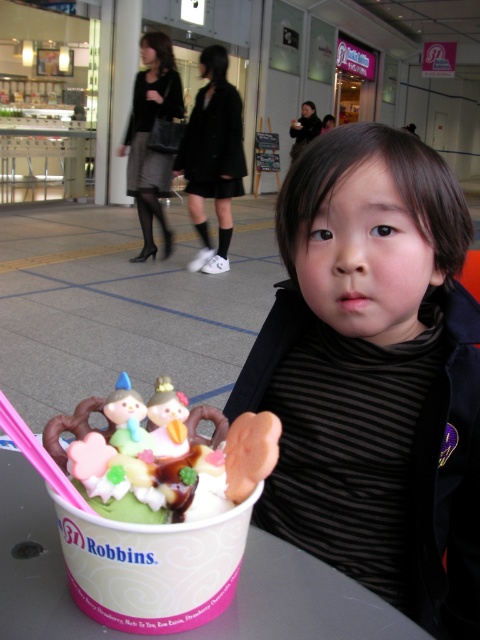
Question: Estimate the real-world distances between objects in this image. Which object is closer to the black fabric skirt at center?

Choices:
 (A) black striped shirt at center
 (B) matte black skirt at center

Answer: (B)

Question: In this image, where is black fabric skirt at center located relative to matte black skirt at center?

Choices:
 (A) above
 (B) below

Answer: (B)

Question: Which object is positioned closest to the matte black skirt at center?

Choices:
 (A) black fabric skirt at center
 (B) black striped shirt at center

Answer: (A)

Question: Can you confirm if black striped shirt at center is positioned to the right of matte black skirt at center?

Choices:
 (A) yes
 (B) no

Answer: (A)

Question: From the image, what is the correct spatial relationship of black fabric skirt at center in relation to matte black skirt at center?

Choices:
 (A) below
 (B) above

Answer: (A)

Question: Which point is closer to the camera taking this photo?

Choices:
 (A) (228, 61)
 (B) (156, 113)

Answer: (A)